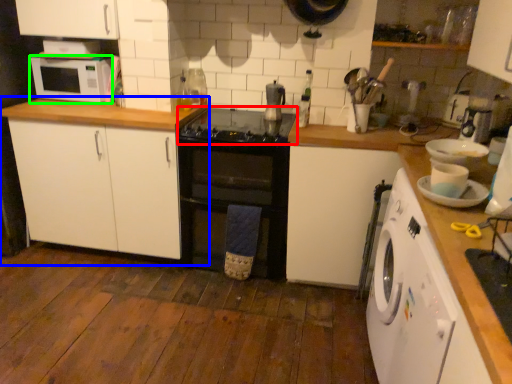
Question: Based on their relative distances, which object is nearer to gas stove (highlighted by a red box)? Choose from cabinetry (highlighted by a blue box) and microwave oven (highlighted by a green box).

Choices:
 (A) cabinetry
 (B) microwave oven

Answer: (A)